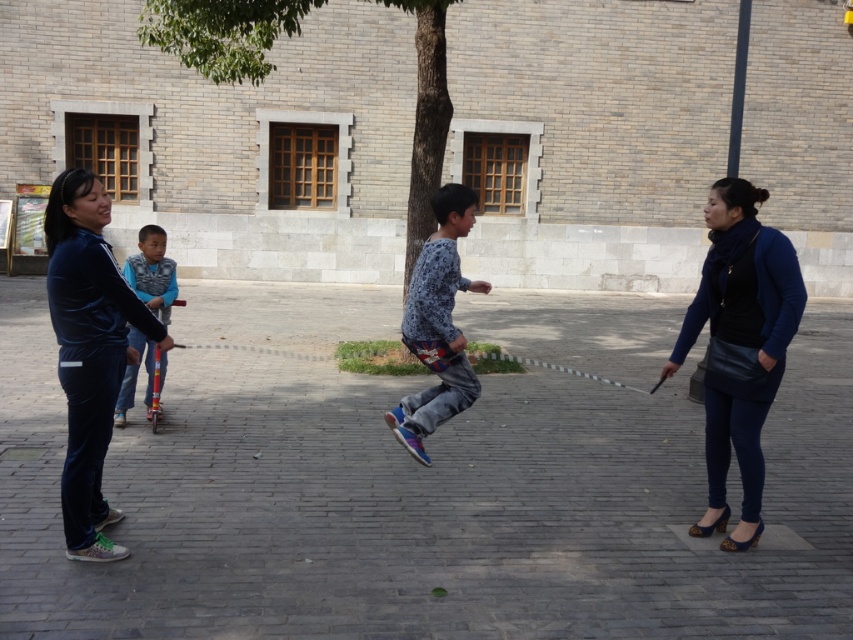
Question: Which of the following is the farthest from the observer?

Choices:
 (A) matte plastic scooter at left
 (B) blue leather jacket at lower right

Answer: (A)

Question: Which object is closer to the camera taking this photo?

Choices:
 (A) matte plastic scooter at left
 (B) blue printed shirt at center
 (C) blue leather jacket at lower right
 (D) velvet blue tracksuit at left

Answer: (D)

Question: Is blue leather jacket at lower right behind matte plastic scooter at left?

Choices:
 (A) no
 (B) yes

Answer: (A)

Question: Where is velvet blue tracksuit at left located in relation to matte plastic scooter at left in the image?

Choices:
 (A) right
 (B) left

Answer: (A)

Question: Among these objects, which one is farthest from the camera?

Choices:
 (A) matte plastic scooter at left
 (B) velvet blue tracksuit at left

Answer: (A)

Question: From the image, what is the correct spatial relationship of blue leather jacket at lower right in relation to blue printed shirt at center?

Choices:
 (A) left
 (B) right

Answer: (B)